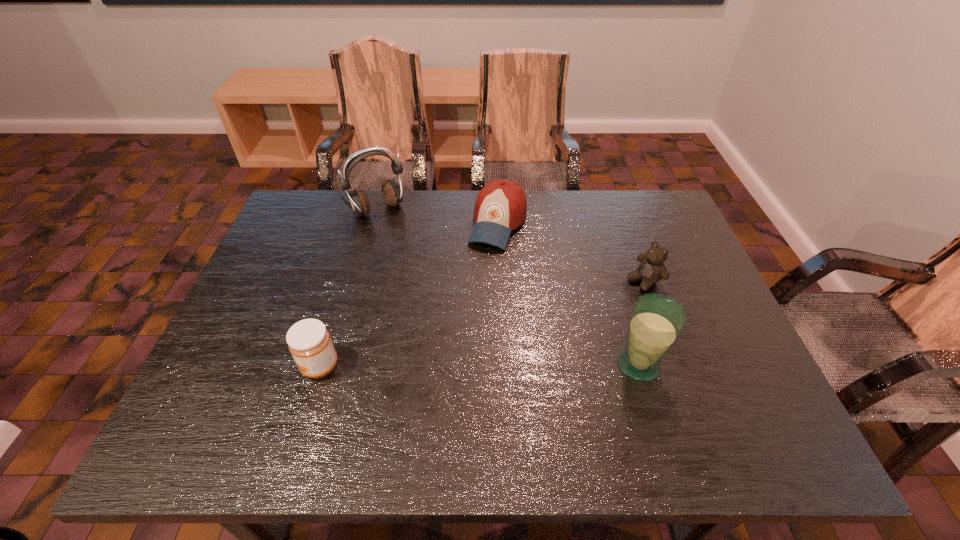
Find the location of a particular element. vacant space that satisfies the following two spatial constraints: 1. on the front side of the third object from right to left; 2. on the right side of the second tallest object is located at coordinates (504, 364).

Where is `vacant space that satisfies the following two spatial constraints: 1. on the front side of the tallest object; 2. on the left side of the second tallest object`? The width and height of the screenshot is (960, 540). vacant space that satisfies the following two spatial constraints: 1. on the front side of the tallest object; 2. on the left side of the second tallest object is located at coordinates (335, 364).